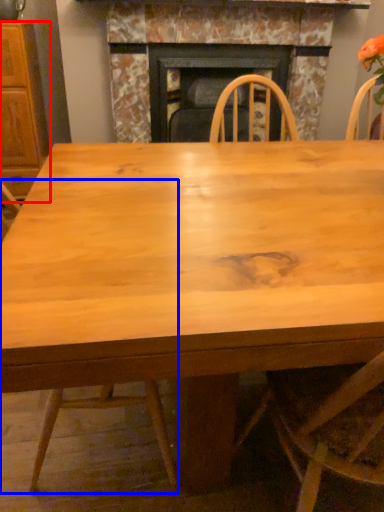
Question: Which point is closer to the camera, cabinetry (highlighted by a red box) or chair (highlighted by a blue box)?

Choices:
 (A) cabinetry
 (B) chair

Answer: (B)